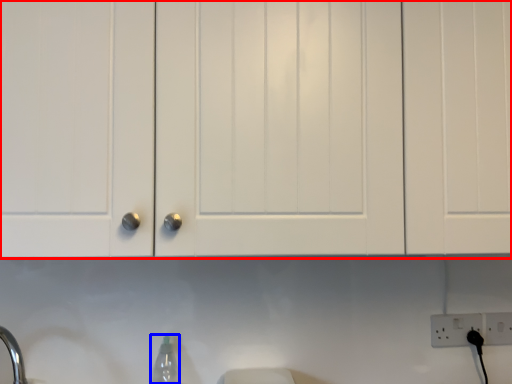
Question: Among these objects, which one is nearest to the camera, cabinetry (highlighted by a red box) or bottle (highlighted by a blue box)?

Choices:
 (A) cabinetry
 (B) bottle

Answer: (A)